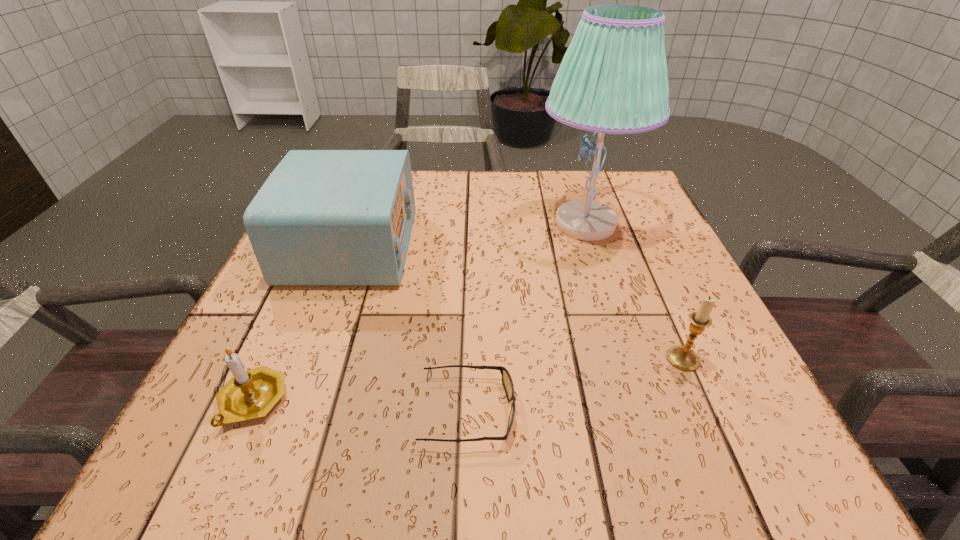
This screenshot has height=540, width=960. I want to click on free spot that satisfies the following two spatial constraints: 1. on the front panel of the third tallest object; 2. on the right side of the fourth shortest object, so click(x=310, y=359).

Locate an element on the screen. free space that satisfies the following two spatial constraints: 1. on the front side of the right candle holder; 2. on the front-facing side of the shortest object is located at coordinates click(706, 410).

Where is `vacant space that satisfies the following two spatial constraints: 1. on the front panel of the right candle holder; 2. on the right side of the radio receiver`? vacant space that satisfies the following two spatial constraints: 1. on the front panel of the right candle holder; 2. on the right side of the radio receiver is located at coordinates (310, 359).

Image resolution: width=960 pixels, height=540 pixels. I want to click on vacant region that satisfies the following two spatial constraints: 1. on the front side of the lamp; 2. on the front panel of the second tallest object, so click(592, 246).